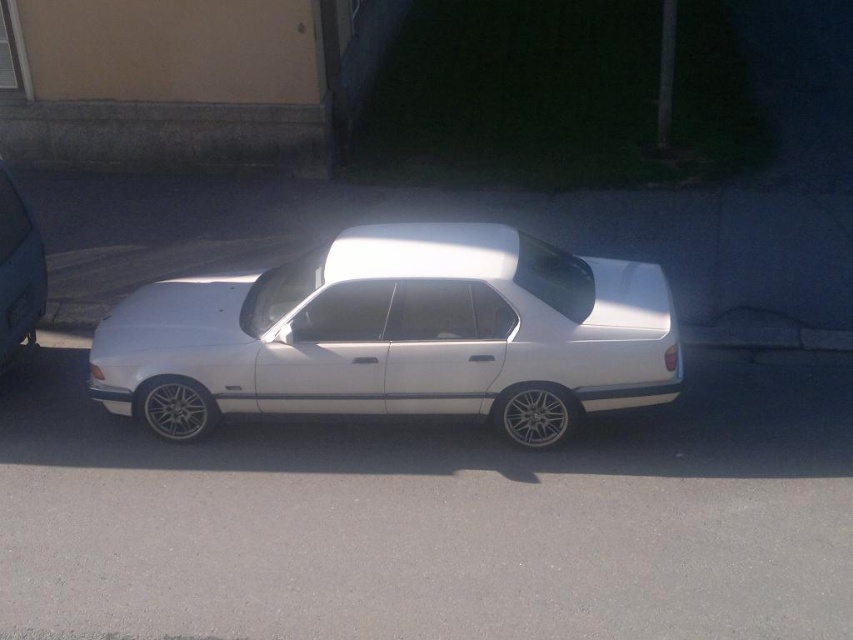
Does point (41, 273) come behind point (28, 300)?

Yes.

Does metallic silver car at left come in front of black plastic license plate at center?

That is True.

You are a GUI agent. You are given a task and a screenshot of the screen. Output one action in this format:
    pyautogui.click(x=<x>, y=<y>)
    Task: Click on the metallic silver car at left
    
    Given the screenshot: What is the action you would take?
    pyautogui.click(x=18, y=273)

The height and width of the screenshot is (640, 853). Identify the location of metallic silver car at left. (18, 273).

Based on the photo, between white metallic car at center and black plastic license plate at center, which one is positioned higher?

black plastic license plate at center is higher up.

Is point (236, 358) behind point (10, 314)?

No.

At what (x,y) coordinates should I click in order to perform the action: click on white metallic car at center. Please return your answer as a coordinate pair (x, y). This screenshot has width=853, height=640. Looking at the image, I should click on (396, 336).

In order to click on white metallic car at center in this screenshot , I will do [x=396, y=336].

Is white metallic car at center wider than metallic silver car at left?

Yes, white metallic car at center is wider than metallic silver car at left.

Does point (389, 381) come farther from viewer compared to point (10, 193)?

No, it is not.

At what (x,y) coordinates should I click in order to perform the action: click on white metallic car at center. Please return your answer as a coordinate pair (x, y). Looking at the image, I should click on (396, 336).